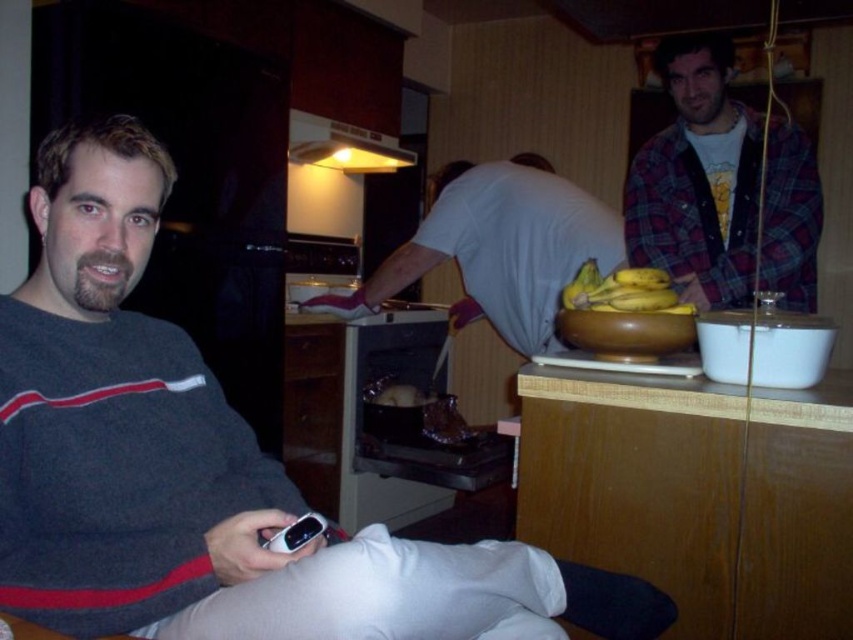
You are organizing a closet and notice the flannel shirt at upper right and the white matte shirt at center. Which shirt is closer to you when standing in front of the closet?

The flannel shirt at upper right is closer to you because it is in front of the white matte shirt at center.

You are standing in the kitchen and see two points marked in the scene. Which point, point (412, 605) or point (593, 294), is closer to you?

Point (412, 605) is closer to the viewer than point (593, 294).